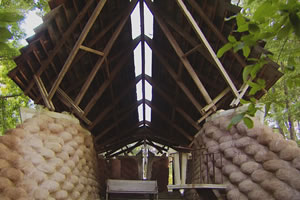
I want to click on support beam, so click(76, 48).